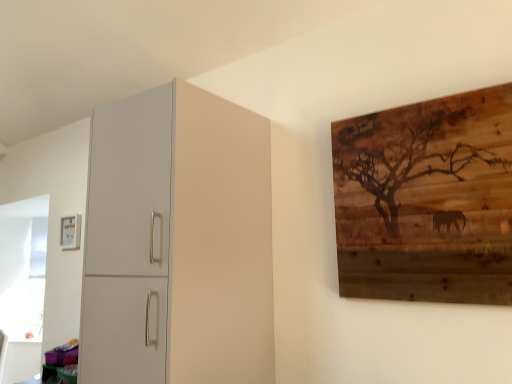
Question: Is point (162, 345) closer or farther from the camera than point (74, 241)?

Choices:
 (A) farther
 (B) closer

Answer: (B)

Question: Looking at the image, does matte white cabinet at left seem bigger or smaller compared to matte white picture frame at upper left, the first picture frame in the back-to-front sequence?

Choices:
 (A) big
 (B) small

Answer: (A)

Question: Considering the real-world distances, which object is closest to the matte white picture frame at upper left, marked as the second picture frame in a right-to-left arrangement?

Choices:
 (A) wooden artwork at upper right, the 1th picture frame from the right
 (B) matte white cabinet at left

Answer: (B)

Question: Based on their relative distances, which object is nearer to the matte white cabinet at left?

Choices:
 (A) matte white picture frame at upper left, the first picture frame in the back-to-front sequence
 (B) wooden artwork at upper right, arranged as the second picture frame when viewed from the back

Answer: (B)